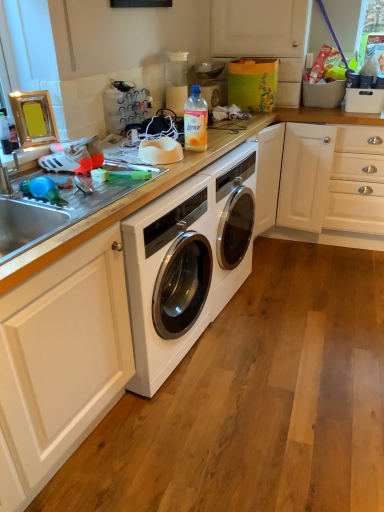
At what (x,y) coordinates should I click in order to perform the action: click on unoccupied space behind translucent plastic bottle at center. Please return your answer as a coordinate pair (x, y). Looking at the image, I should click on (217, 137).